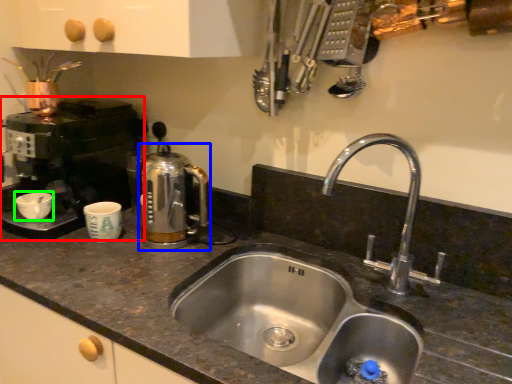
Question: Estimate the real-world distances between objects in this image. Which object is farther from coffee machine (highlighted by a red box), coffeepot (highlighted by a blue box) or basin (highlighted by a green box)?

Choices:
 (A) coffeepot
 (B) basin

Answer: (A)